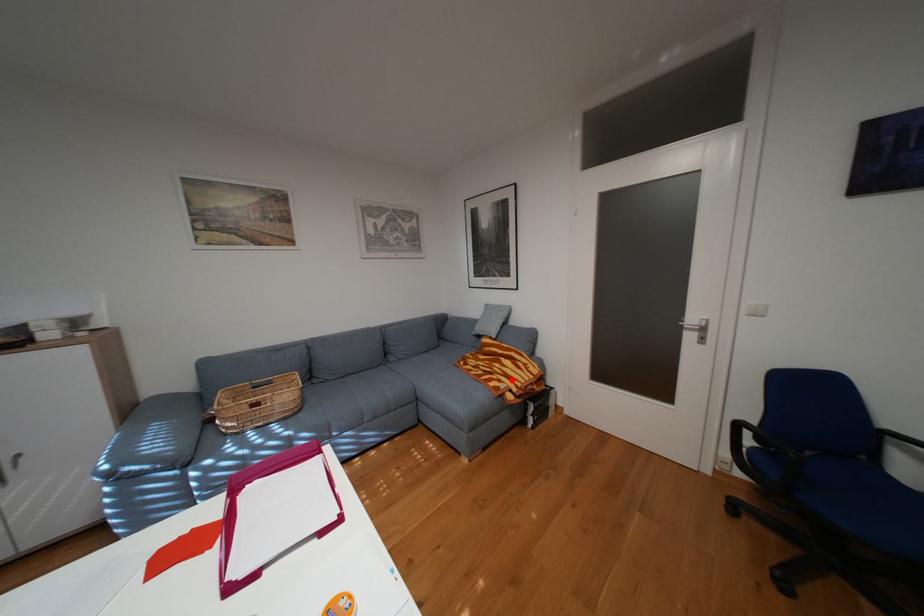
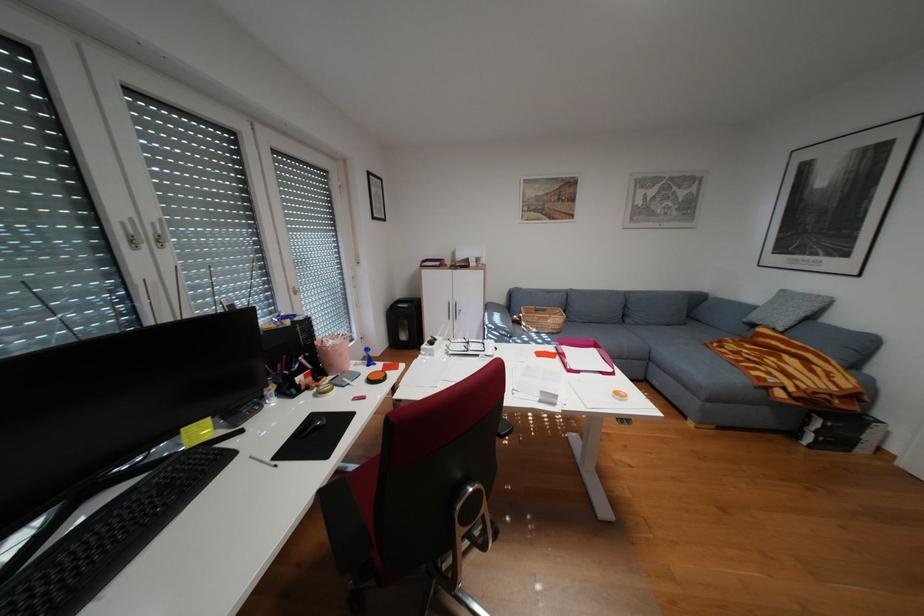
In the second image, find the point that corresponds to the highlighted location in the first image.

(782, 373)